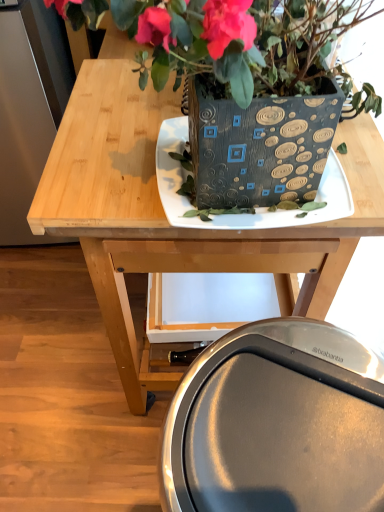
Question: Considering their positions, is matte black plate at center located in front of or behind wooden table at center?

Choices:
 (A) behind
 (B) front

Answer: (B)

Question: Considering the positions of matte black plate at center and wooden table at center in the image, is matte black plate at center wider or thinner than wooden table at center?

Choices:
 (A) thin
 (B) wide

Answer: (A)

Question: Based on their relative distances, which object is nearer to the metallic silver swivel chair at lower center?

Choices:
 (A) wooden table at center
 (B) matte black plate at center
 (C) textured black planter at center

Answer: (B)

Question: Which is nearer to the metallic silver swivel chair at lower center?

Choices:
 (A) textured black planter at center
 (B) matte black plate at center
 (C) wooden table at center

Answer: (B)